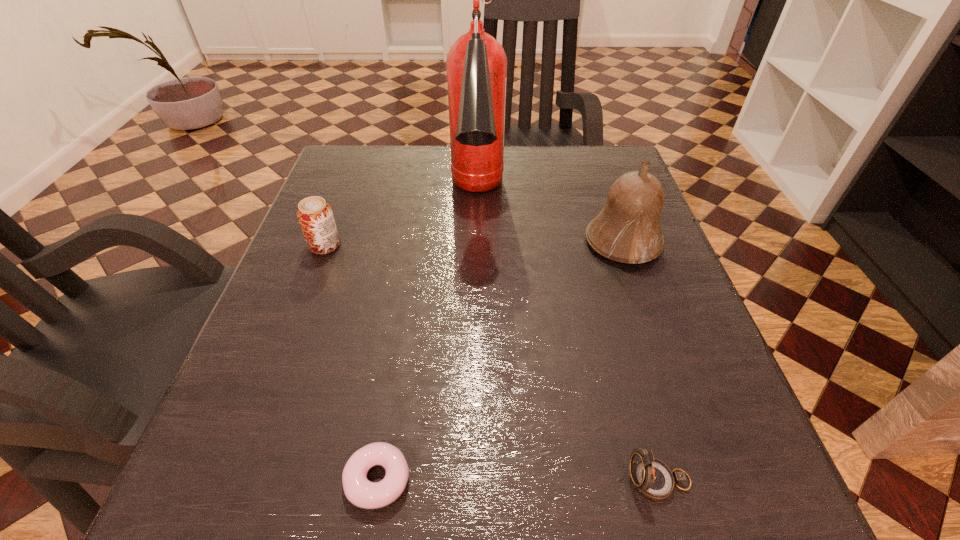
Image resolution: width=960 pixels, height=540 pixels. In order to click on free area in between the doughnut and the third object from right to left in this screenshot , I will do `click(427, 339)`.

Image resolution: width=960 pixels, height=540 pixels. In order to click on free space between the second object from left to right and the fire extinguisher in this screenshot , I will do `click(427, 339)`.

Locate an element on the screen. free space that is in between the compass and the fourth object from right to left is located at coordinates (518, 480).

The height and width of the screenshot is (540, 960). Find the location of `vacant space in between the bell and the shortest object`. vacant space in between the bell and the shortest object is located at coordinates (500, 361).

The image size is (960, 540). What are the coordinates of `blank region between the second object from left to right and the compass` in the screenshot? It's located at (518, 480).

You are a GUI agent. You are given a task and a screenshot of the screen. Output one action in this format:
    pyautogui.click(x=<x>, y=<y>)
    Task: Click on the free space between the second tallest object and the doughnut
    Image resolution: width=960 pixels, height=540 pixels.
    Given the screenshot: What is the action you would take?
    pyautogui.click(x=500, y=361)

You are a GUI agent. You are given a task and a screenshot of the screen. Output one action in this format:
    pyautogui.click(x=<x>, y=<y>)
    Task: Click on the vacant point located between the third object from right to left and the second tallest object
    This screenshot has height=540, width=960.
    Given the screenshot: What is the action you would take?
    pyautogui.click(x=550, y=220)

Identify the location of vacant space that's between the third object from left to right and the bell. (550, 220).

This screenshot has width=960, height=540. Find the location of `free spot between the second object from left to right and the third object from right to left`. free spot between the second object from left to right and the third object from right to left is located at coordinates (427, 339).

What are the coordinates of `the closest object to the beer can` in the screenshot? It's located at (476, 63).